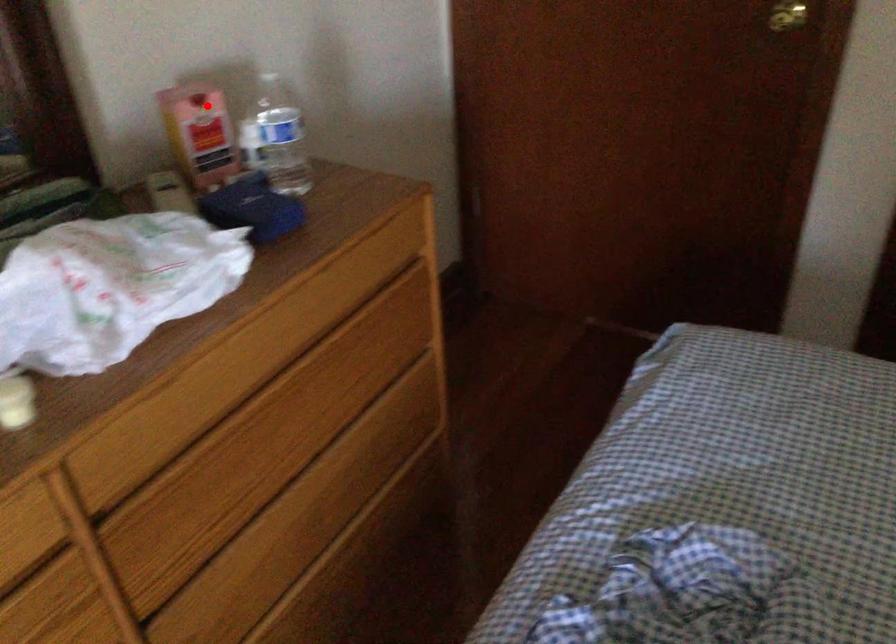
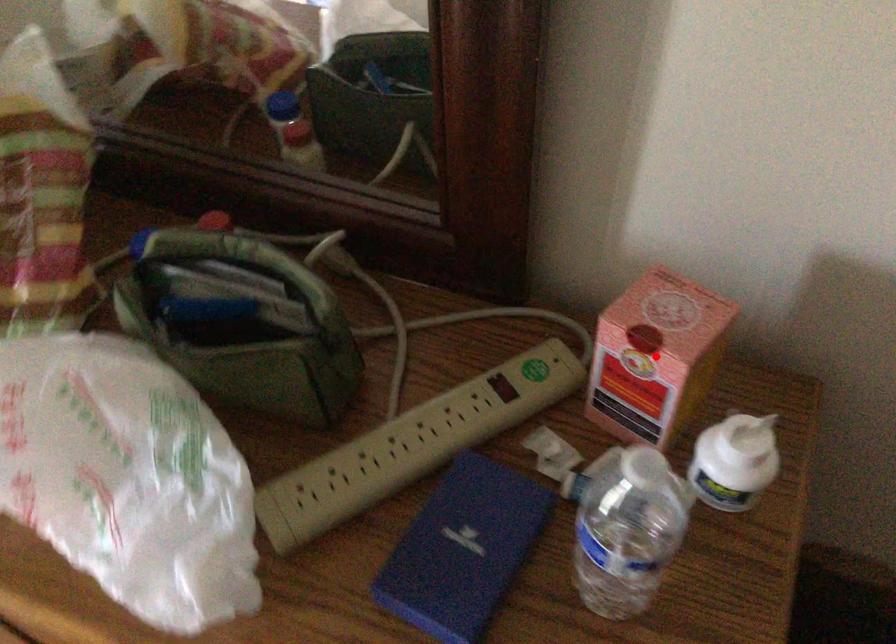
I am providing you with two images of the same scene from different viewpoints. A red point is marked on the first image and another point is marked on the second image. Does the point marked in image1 correspond to the same location as the one in image2?

Yes